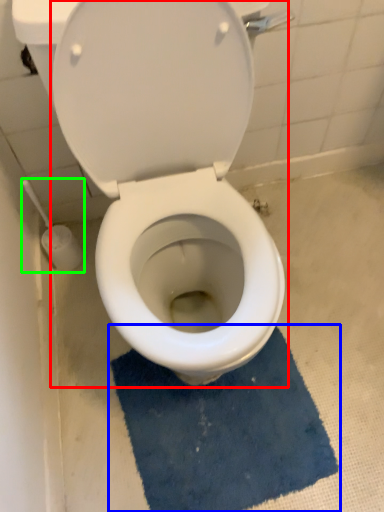
Question: Which is farther away from toilet (highlighted by a red box)? bath mat (highlighted by a blue box) or brush (highlighted by a green box)?

Choices:
 (A) bath mat
 (B) brush

Answer: (B)